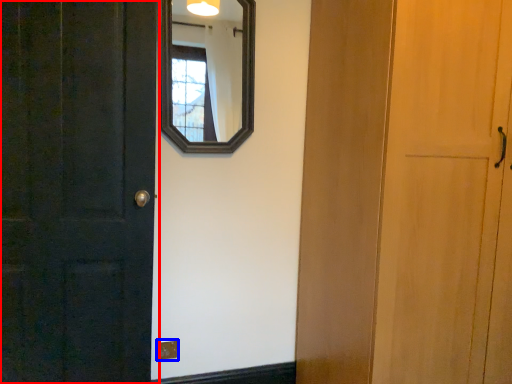
Question: Among these objects, which one is nearest to the camera, door (highlighted by a red box) or electric outlet (highlighted by a blue box)?

Choices:
 (A) door
 (B) electric outlet

Answer: (A)